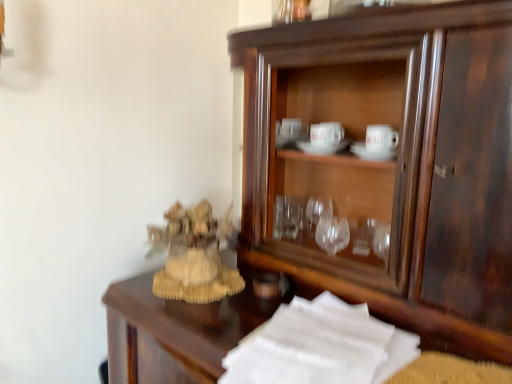
The width and height of the screenshot is (512, 384). I want to click on free region under beige woven statue at left (from a real-world perspective), so click(x=189, y=278).